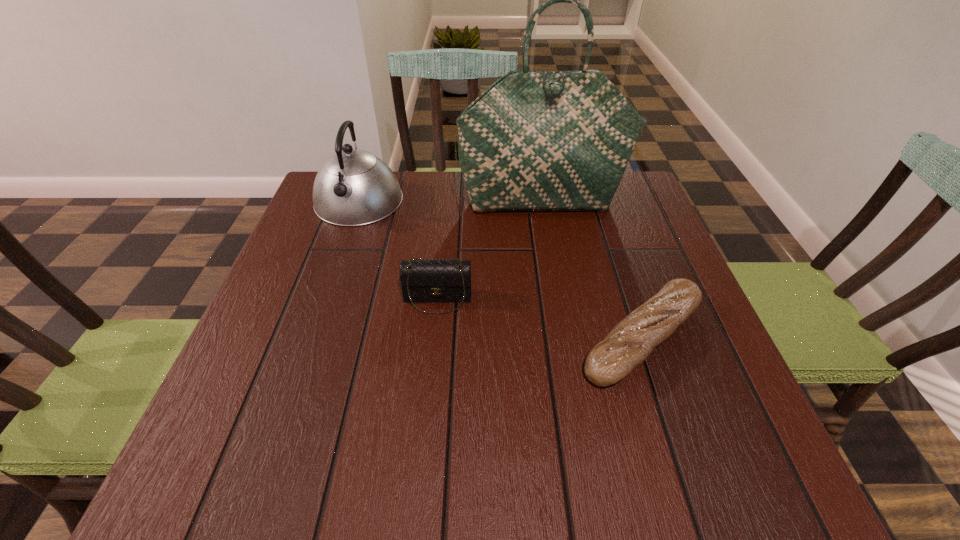
This screenshot has width=960, height=540. I want to click on the tallest object, so click(x=534, y=140).

Find the location of `the third shortest object`. the third shortest object is located at coordinates (353, 187).

Identify the location of kettle. The image size is (960, 540). point(353,187).

Identify the location of the second shortest object. This screenshot has height=540, width=960. (425, 280).

This screenshot has width=960, height=540. In order to click on the shortest object in this screenshot , I will do `click(631, 341)`.

This screenshot has height=540, width=960. What are the coordinates of `vacant space located on the back of the tote bag` in the screenshot? It's located at (538, 179).

Find the location of `free space located from the spout of the kettle`. free space located from the spout of the kettle is located at coordinates (335, 268).

Image resolution: width=960 pixels, height=540 pixels. I want to click on vacant space situated on the front flap of the third tallest object, so click(430, 373).

Locate an element on the screen. The image size is (960, 540). blank space located on the back of the baguet is located at coordinates (614, 253).

This screenshot has width=960, height=540. I want to click on tote bag situated at the far edge, so click(x=534, y=140).